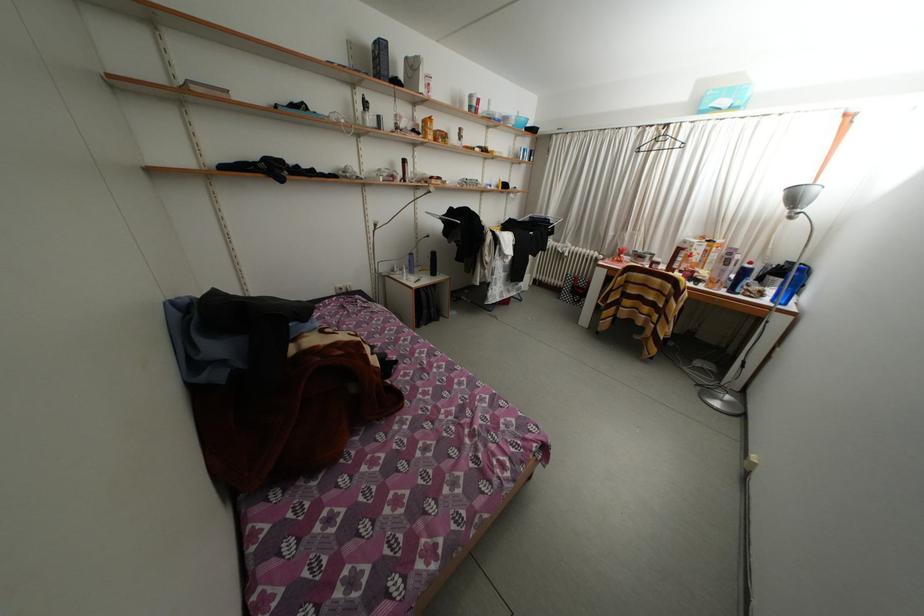
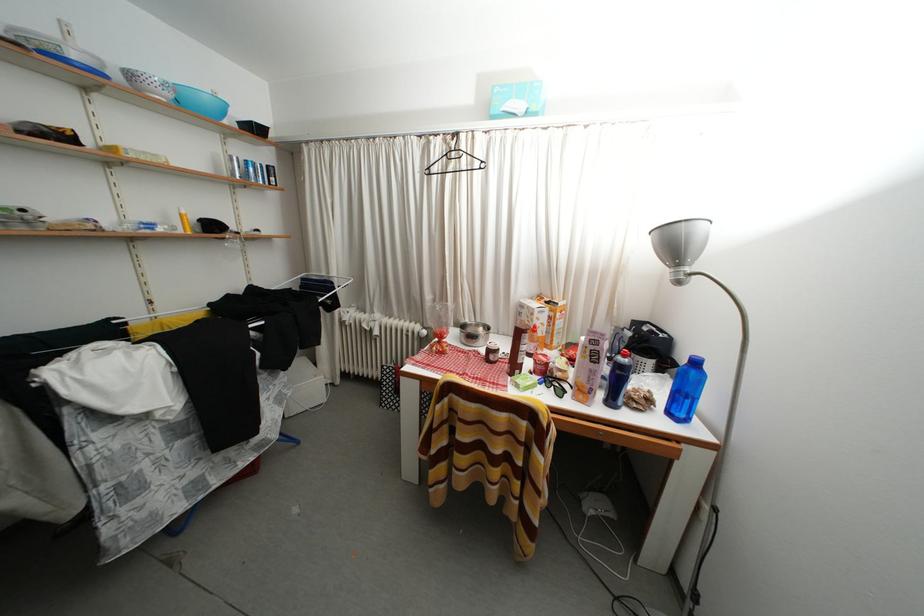
Where in the second image is the point corresponding to (634,262) from the first image?

(460, 342)